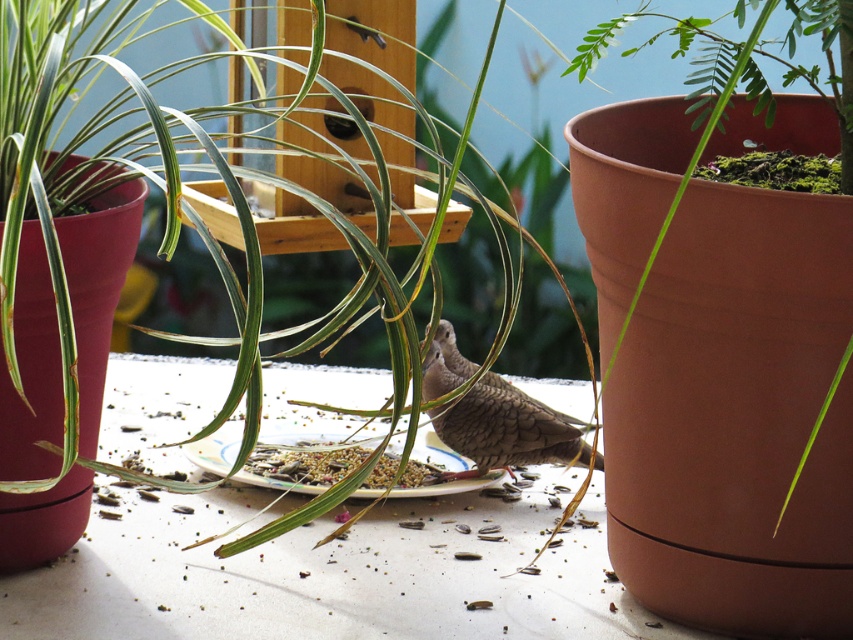
You are a gardener who wants to water the green leafy plant at center. The coordinates given are in a normalized system where the bottom left corner is the origin. To reach the plant, you need to move from the bottom left corner towards the point marked at point (x=39, y=522). In which direction should you move first?

The point (x=39, y=522) is located at the center of the image. Since the gardener is starting from the bottom left corner, they should move diagonally towards the center to reach the green leafy plant at center.

You are a bird trying to reach the brown textured seeds at center. There is a green leafy plant at center in your path. Can you easily access the seeds without moving the plant?

The green leafy plant at center is closer to the viewer than the brown textured seeds at center, so the plant is blocking the path. The bird would need to move the plant to access the seeds.

You are a small insect trying to reach the birdseed on the white plate. There is a green leafy plant at center and a brown speckled bird at center in your way. Which object should you avoid to get to the birdseed?

You should avoid the green leafy plant at center because it is closer to the viewer than the brown speckled bird at center, blocking your path.